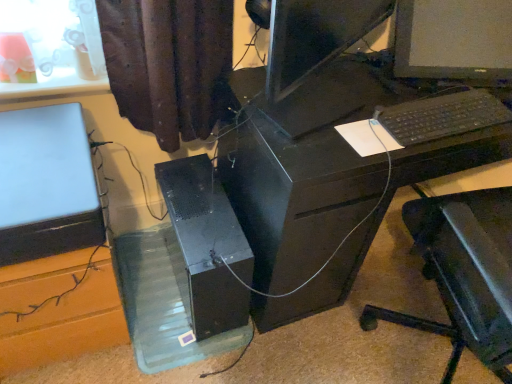
Where is `free space above black matte computer tower at center (from a real-world perspective)`? The width and height of the screenshot is (512, 384). free space above black matte computer tower at center (from a real-world perspective) is located at coordinates (199, 206).